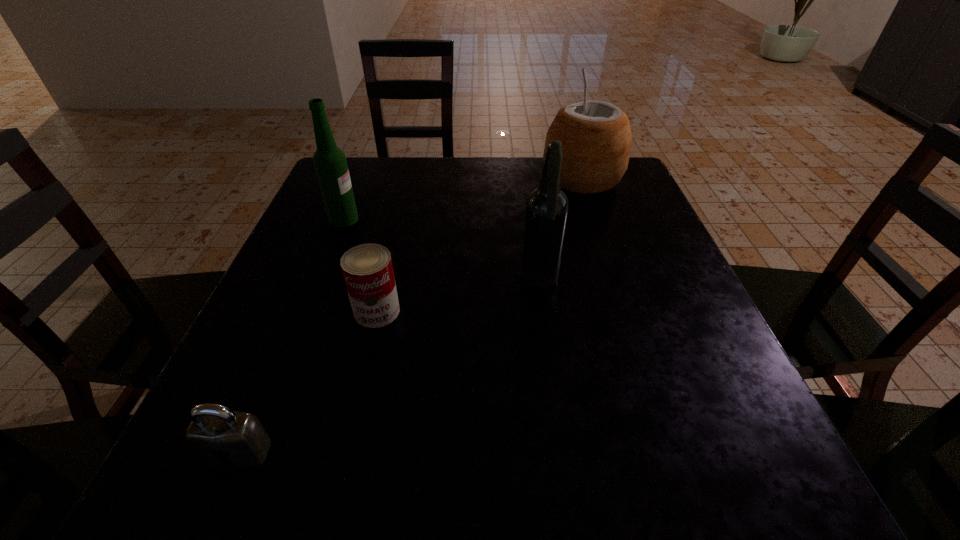
Identify the location of the nearer beer bottle. This screenshot has height=540, width=960. (547, 207).

Where is `the fourth object from left to right`? the fourth object from left to right is located at coordinates (547, 207).

Identify the location of the farther beer bottle. (330, 163).

Find the location of a particular element. the left beer bottle is located at coordinates (330, 163).

Locate an element on the screen. Image resolution: width=960 pixels, height=540 pixels. the farthest object is located at coordinates (596, 137).

The image size is (960, 540). Find the location of `coconut`. coconut is located at coordinates (596, 137).

Where is `can`? This screenshot has height=540, width=960. can is located at coordinates (367, 269).

What are the coordinates of `the nearest object` in the screenshot? It's located at (215, 428).

The height and width of the screenshot is (540, 960). I want to click on free space located 0.210m on the right of the second object from right to left, so click(x=669, y=281).

Identify the location of vacant region located 0.370m on the label of the left beer bottle. (522, 220).